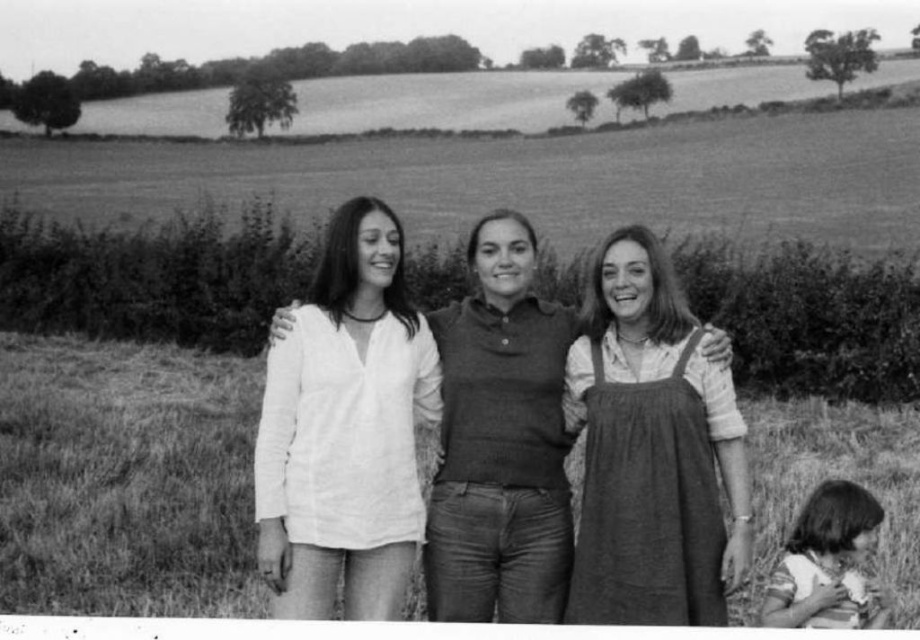
Question: Does white cotton shirt at left appear over striped cotton shirt at lower right?

Choices:
 (A) no
 (B) yes

Answer: (B)

Question: From the image, what is the correct spatial relationship of white cotton shirt at left in relation to striped cotton shirt at lower right?

Choices:
 (A) above
 (B) below

Answer: (A)

Question: Does dungaree dress at center have a greater width compared to matte white shirt at center?

Choices:
 (A) yes
 (B) no

Answer: (A)

Question: Which object is farther from the camera taking this photo?

Choices:
 (A) striped cotton shirt at lower right
 (B) matte white shirt at center

Answer: (B)

Question: Based on their relative distances, which object is farther from the dungaree dress at center?

Choices:
 (A) matte white shirt at center
 (B) striped cotton shirt at lower right
 (C) white cotton shirt at left

Answer: (C)

Question: Which of the following is the farthest from the observer?

Choices:
 (A) dungaree dress at center
 (B) striped cotton shirt at lower right
 (C) white cotton shirt at left

Answer: (B)